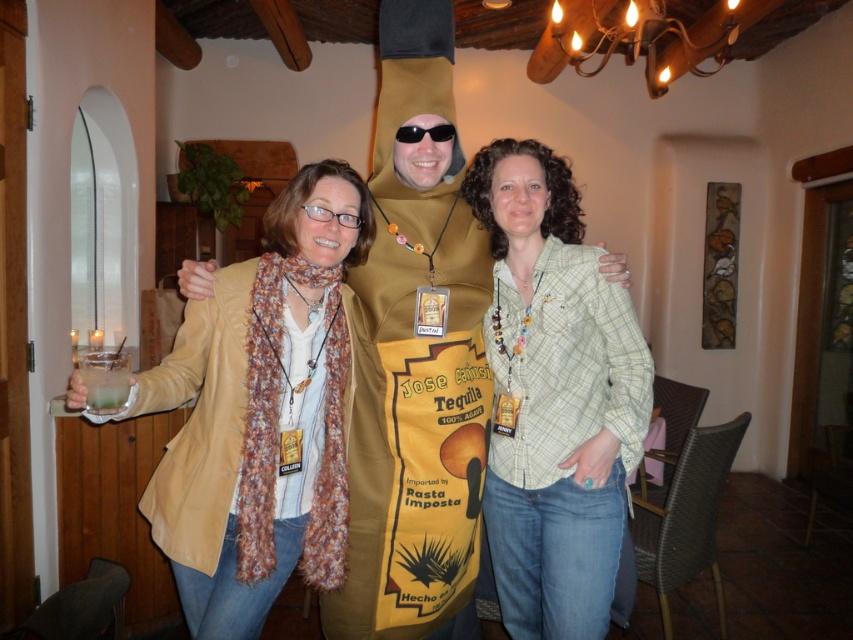
Question: Does beige textured scarf at center appear under gold paper bag at center?

Choices:
 (A) no
 (B) yes

Answer: (B)

Question: Estimate the real-world distances between objects in this image. Which object is farther from the clear glass at left?

Choices:
 (A) gold paper bag at center
 (B) beige textured scarf at center
 (C) light green plaid shirt at center

Answer: (C)

Question: Which object is closer to the camera taking this photo?

Choices:
 (A) beige textured scarf at center
 (B) clear glass at left
 (C) gold paper bag at center

Answer: (A)

Question: Which object appears closest to the camera in this image?

Choices:
 (A) light green plaid shirt at center
 (B) clear glass at left
 (C) gold paper bag at center
 (D) beige textured scarf at center

Answer: (D)

Question: Does gold paper bag at center appear on the right side of clear glass at left?

Choices:
 (A) yes
 (B) no

Answer: (A)

Question: Can you confirm if light green plaid shirt at center is smaller than gold paper bag at center?

Choices:
 (A) no
 (B) yes

Answer: (B)